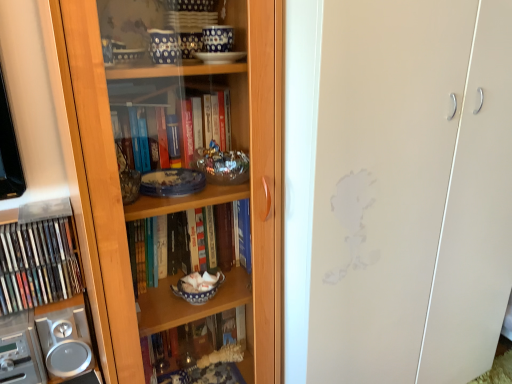
Question: Can we say matte plastic books at left lies outside transparent glass cabinet at center?

Choices:
 (A) yes
 (B) no

Answer: (A)

Question: Is transparent glass cabinet at center a part of matte plastic books at left?

Choices:
 (A) yes
 (B) no

Answer: (B)

Question: Can you confirm if matte plastic books at left is taller than transparent glass cabinet at center?

Choices:
 (A) yes
 (B) no

Answer: (B)

Question: From a real-world perspective, does matte plastic books at left stand above transparent glass cabinet at center?

Choices:
 (A) no
 (B) yes

Answer: (A)

Question: From the image's perspective, is matte plastic books at left over transparent glass cabinet at center?

Choices:
 (A) no
 (B) yes

Answer: (A)

Question: From their relative heights in the image, would you say transparent glass cabinet at center is taller or shorter than wooden bookcase at left?

Choices:
 (A) short
 (B) tall

Answer: (B)

Question: Is transparent glass cabinet at center wider or thinner than wooden bookcase at left?

Choices:
 (A) wide
 (B) thin

Answer: (A)

Question: From the image's perspective, is transparent glass cabinet at center above or below wooden bookcase at left?

Choices:
 (A) below
 (B) above

Answer: (B)

Question: Is transparent glass cabinet at center in front of or behind wooden bookcase at left in the image?

Choices:
 (A) front
 (B) behind

Answer: (B)

Question: From a real-world perspective, is wooden bookcase at left physically located above or below silver metallic speaker at lower left?

Choices:
 (A) below
 (B) above

Answer: (B)

Question: Is point (268, 94) closer or farther from the camera than point (9, 365)?

Choices:
 (A) closer
 (B) farther

Answer: (A)

Question: From the image's perspective, is wooden bookcase at left located above or below silver metallic speaker at lower left?

Choices:
 (A) above
 (B) below

Answer: (A)

Question: Considering their positions, is wooden bookcase at left located in front of or behind silver metallic speaker at lower left?

Choices:
 (A) front
 (B) behind

Answer: (A)

Question: Relative to silver metallic speaker at lower left, is transparent glass cabinet at center in front or behind?

Choices:
 (A) front
 (B) behind

Answer: (A)

Question: Considering the positions of transparent glass cabinet at center and silver metallic speaker at lower left in the image, is transparent glass cabinet at center taller or shorter than silver metallic speaker at lower left?

Choices:
 (A) tall
 (B) short

Answer: (A)